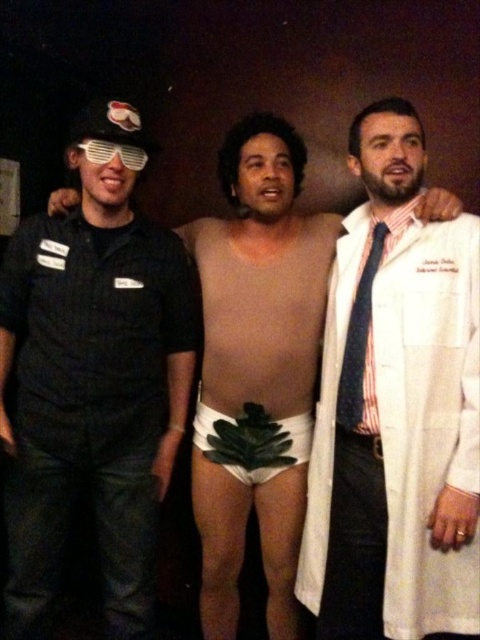
Question: Is the position of black matte uniform at left more distant than that of white lab coat at right?

Choices:
 (A) no
 (B) yes

Answer: (B)

Question: Which object is positioned farthest from the blue striped tie at right?

Choices:
 (A) white lab coat at right
 (B) white matte underwear at center
 (C) white plastic goggles at left

Answer: (C)

Question: Which of the following is the farthest from the observer?

Choices:
 (A) white matte underwear at center
 (B) black matte uniform at left

Answer: (A)

Question: Is black matte uniform at left to the left of blue striped tie at right from the viewer's perspective?

Choices:
 (A) no
 (B) yes

Answer: (B)

Question: Based on their relative distances, which object is nearer to the white lab coat at right?

Choices:
 (A) white plastic goggles at left
 (B) blue striped tie at right
 (C) black matte uniform at left

Answer: (B)

Question: Where is white lab coat at right located in relation to blue striped tie at right in the image?

Choices:
 (A) left
 (B) right

Answer: (B)